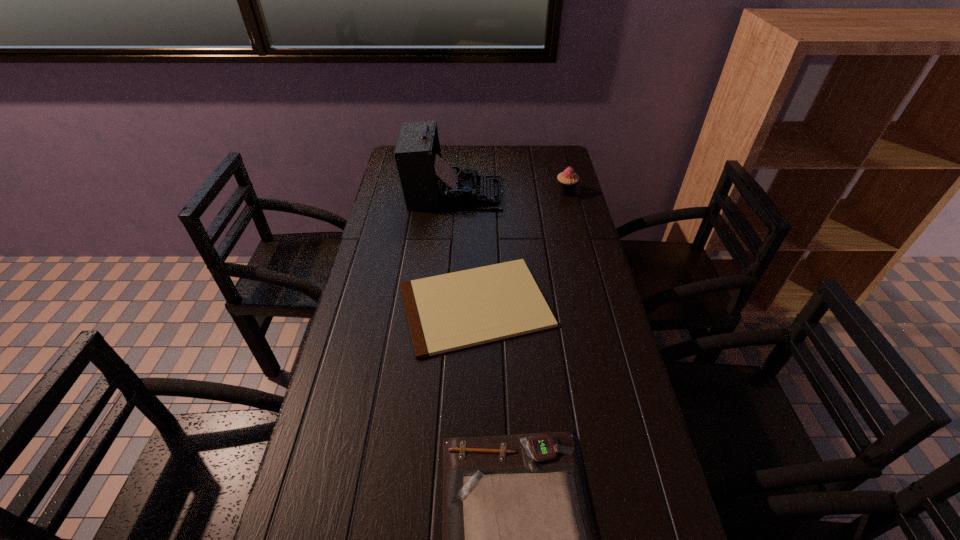
Locate an element on the screen. This screenshot has width=960, height=540. typewriter is located at coordinates (428, 182).

This screenshot has width=960, height=540. I want to click on the rightmost object, so (568, 180).

At what (x,y) coordinates should I click in order to perform the action: click on the third shortest object. Please return your answer as a coordinate pair (x, y). Looking at the image, I should click on (568, 180).

This screenshot has width=960, height=540. Find the location of `the shortest object`. the shortest object is located at coordinates (452, 311).

You are a GUI agent. You are given a task and a screenshot of the screen. Output one action in this format:
    pyautogui.click(x=<x>, y=<y>)
    Task: Click on the third farthest object
    The height and width of the screenshot is (540, 960).
    Given the screenshot: What is the action you would take?
    pyautogui.click(x=452, y=311)

The width and height of the screenshot is (960, 540). In order to click on vacant space located inside the open case of the typewriter in this screenshot , I will do `click(556, 193)`.

I want to click on free space located 0.190m on the back of the rightmost object, so click(559, 161).

Locate an element on the screen. This screenshot has width=960, height=540. free space located on the front of the third farthest object is located at coordinates (474, 456).

Locate an element on the screen. typewriter present at the left edge is located at coordinates (428, 182).

You are a GUI agent. You are given a task and a screenshot of the screen. Output one action in this format:
    pyautogui.click(x=<x>, y=<y>)
    Task: Click on the clipboard that is at the left edge
    The height and width of the screenshot is (540, 960).
    Given the screenshot: What is the action you would take?
    pyautogui.click(x=452, y=311)